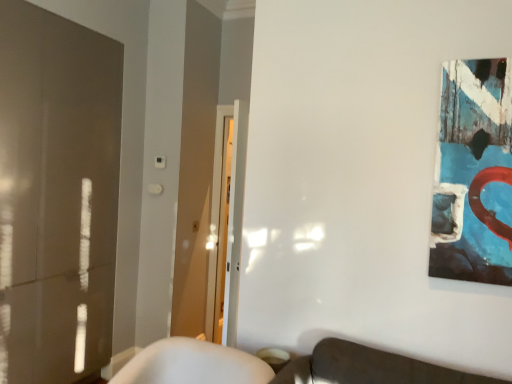
The height and width of the screenshot is (384, 512). Identify the location of free spot above matte glass door at left (from a real-world perspective). (73, 21).